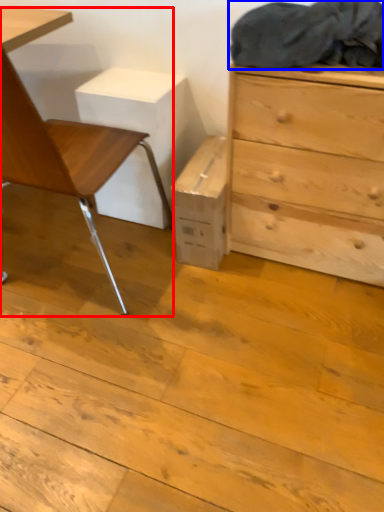
Question: Which of the following is the farthest to the observer, chair (highlighted by a red box) or laundry (highlighted by a blue box)?

Choices:
 (A) chair
 (B) laundry

Answer: (B)